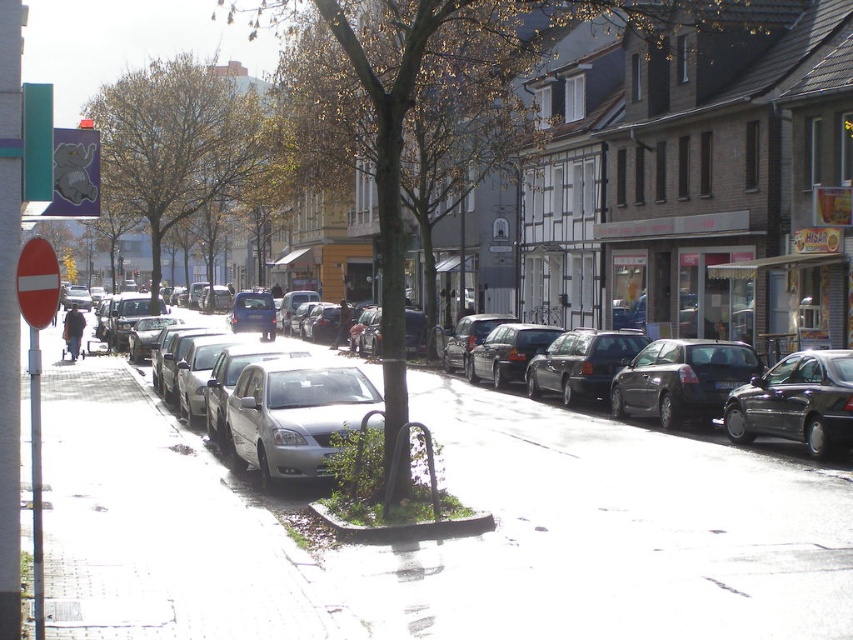
Describe the element at coordinates (277, 404) in the screenshot. The height and width of the screenshot is (640, 853). I see `silver metallic car at center` at that location.

Does point (233, 444) come closer to viewer compared to point (688, 419)?

That is True.

Between point (239, 390) and point (663, 396), which one is positioned behind?

The point (663, 396) is more distant.

You are a GUI agent. You are given a task and a screenshot of the screen. Output one action in this format:
    pyautogui.click(x=<x>, y=<y>)
    Task: Click on the silver metallic car at center
    Image resolution: width=853 pixels, height=640 pixels.
    Given the screenshot: What is the action you would take?
    pyautogui.click(x=277, y=404)

Which is more to the left, shiny dark gray sedan at right or shiny black sedan at center?

From the viewer's perspective, shiny black sedan at center appears more on the left side.

Is point (840, 376) closer to camera compared to point (527, 371)?

Yes, point (840, 376) is in front of point (527, 371).

The height and width of the screenshot is (640, 853). I want to click on shiny dark gray sedan at right, so (796, 403).

Is satin silver sedan at center bigger than shiny dark blue sedan at center right?

Yes, satin silver sedan at center is bigger than shiny dark blue sedan at center right.

Who is taller, satin silver sedan at center or shiny dark blue sedan at center right?

shiny dark blue sedan at center right is taller.

Does point (239, 387) come farther from viewer compared to point (611, 380)?

No, it is not.

I want to click on satin silver sedan at center, so click(294, 413).